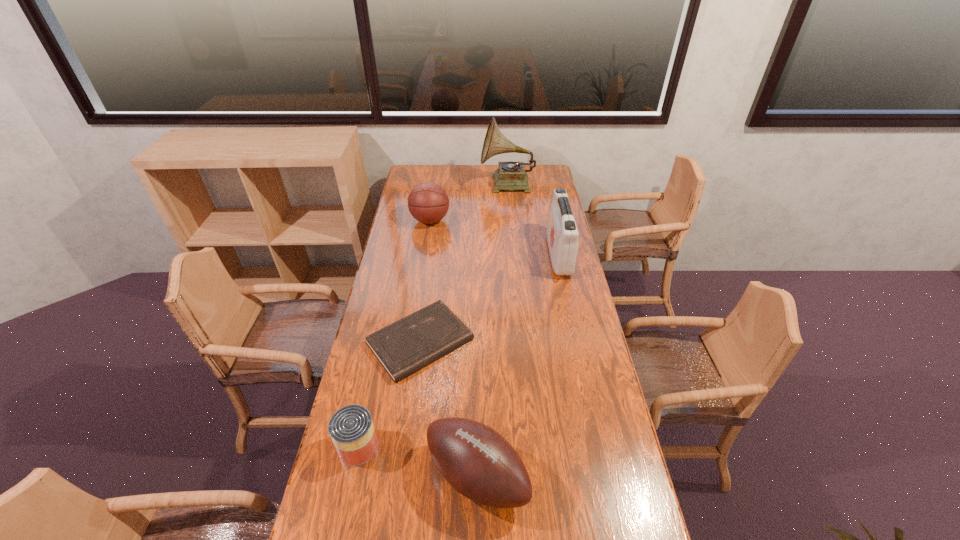
Locate an element on the screen. record player is located at coordinates (511, 175).

The height and width of the screenshot is (540, 960). What are the coordinates of `the tallest object` in the screenshot? It's located at (511, 175).

Image resolution: width=960 pixels, height=540 pixels. Identify the location of the third farthest object. (562, 234).

Identify the location of the first-aid kit. (562, 234).

Where is `the fifth nearest object`? the fifth nearest object is located at coordinates (428, 202).

The height and width of the screenshot is (540, 960). Find the location of `football (American)`. football (American) is located at coordinates (479, 463).

In order to click on the fifth tallest object in this screenshot , I will do `click(351, 428)`.

Where is `the shortest object`? The height and width of the screenshot is (540, 960). the shortest object is located at coordinates (413, 342).

Image resolution: width=960 pixels, height=540 pixels. Find the location of `paperback book`. paperback book is located at coordinates (413, 342).

You are a GUI agent. You are given a task and a screenshot of the screen. Output one action in this format:
    pyautogui.click(x=<x>, y=<y>)
    Task: Click on the vacant space located 0.150m from the horn of the farthest object
    This screenshot has height=540, width=960.
    Given the screenshot: What is the action you would take?
    pyautogui.click(x=454, y=185)